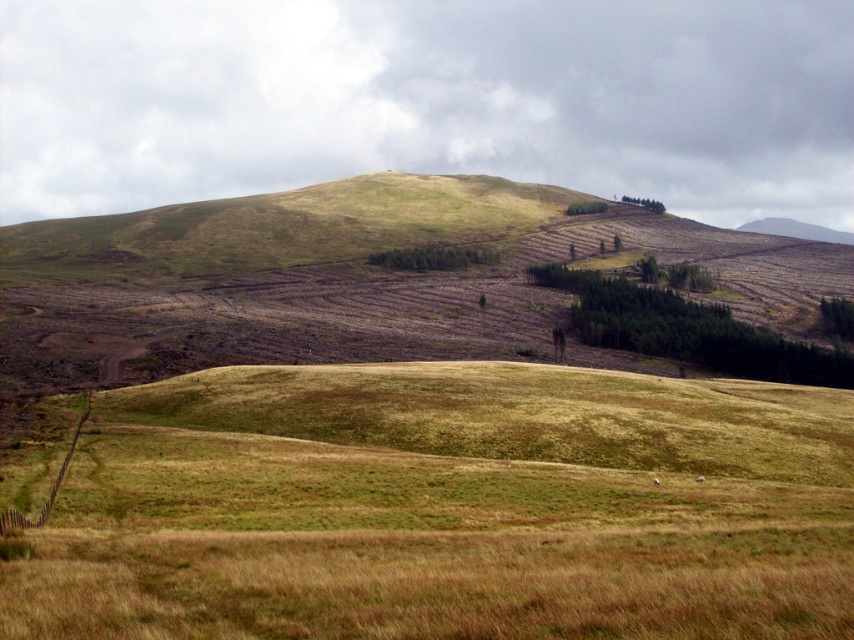
Does green coniferous trees at center come in front of green leafy tree at lower right?

Result: No, it is not.

Who is higher up, green coniferous trees at center or green leafy tree at lower right?

green coniferous trees at center

Where is `green coniferous trees at center`? The image size is (854, 640). green coniferous trees at center is located at coordinates (431, 257).

Looking at this image, who is positioned more to the right, green leafy tree at lower right or green leafy trees at upper center?

Positioned to the right is green leafy tree at lower right.

Does green leafy tree at lower right come behind green leafy trees at upper center?

No.

What do you see at coordinates (837, 317) in the screenshot? Image resolution: width=854 pixels, height=640 pixels. I see `green leafy tree at lower right` at bounding box center [837, 317].

The height and width of the screenshot is (640, 854). Find the location of `green leafy tree at lower right`. green leafy tree at lower right is located at coordinates (837, 317).

Is green textured trees at center smaller than green coniferous trees at center?

No.

Is green textured trees at center thinner than green coniferous trees at center?

Incorrect, green textured trees at center's width is not less than green coniferous trees at center's.

Is point (635, 301) positioned in front of point (408, 253)?

Yes, point (635, 301) is closer to viewer.

Locate an element on the screen. green textured trees at center is located at coordinates (687, 330).